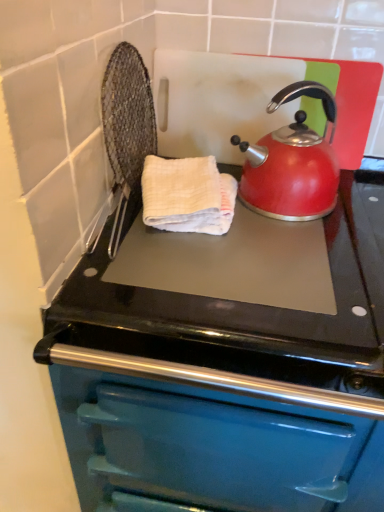
Question: From the image's perspective, is shiny red kettle at upper right located beneath teal enamel oven at center?

Choices:
 (A) no
 (B) yes

Answer: (A)

Question: Does shiny red kettle at upper right have a lesser width compared to teal enamel oven at center?

Choices:
 (A) no
 (B) yes

Answer: (B)

Question: From a real-world perspective, is shiny red kettle at upper right below teal enamel oven at center?

Choices:
 (A) yes
 (B) no

Answer: (B)

Question: Is teal enamel oven at center at the back of shiny red kettle at upper right?

Choices:
 (A) yes
 (B) no

Answer: (B)

Question: Would you consider shiny red kettle at upper right to be distant from teal enamel oven at center?

Choices:
 (A) yes
 (B) no

Answer: (B)

Question: Is white textured hand towel at center to the left or to the right of teal enamel oven at center in the image?

Choices:
 (A) left
 (B) right

Answer: (A)

Question: In terms of size, does white textured hand towel at center appear bigger or smaller than teal enamel oven at center?

Choices:
 (A) small
 (B) big

Answer: (A)

Question: Is white textured hand towel at center inside or outside of teal enamel oven at center?

Choices:
 (A) inside
 (B) outside

Answer: (B)

Question: From the image's perspective, is white textured hand towel at center located above or below teal enamel oven at center?

Choices:
 (A) above
 (B) below

Answer: (A)

Question: Considering their positions, is shiny red kettle at upper right located in front of or behind teal enamel oven at center?

Choices:
 (A) behind
 (B) front

Answer: (A)

Question: From the image's perspective, is shiny red kettle at upper right above or below teal enamel oven at center?

Choices:
 (A) below
 (B) above

Answer: (B)

Question: From a real-world perspective, is shiny red kettle at upper right above or below teal enamel oven at center?

Choices:
 (A) above
 (B) below

Answer: (A)

Question: Is shiny red kettle at upper right wider or thinner than teal enamel oven at center?

Choices:
 (A) thin
 (B) wide

Answer: (A)

Question: Would you say teal enamel oven at center is inside or outside shiny red kettle at upper right?

Choices:
 (A) outside
 (B) inside

Answer: (A)

Question: Would you say teal enamel oven at center is to the left or to the right of shiny red kettle at upper right in the picture?

Choices:
 (A) left
 (B) right

Answer: (B)